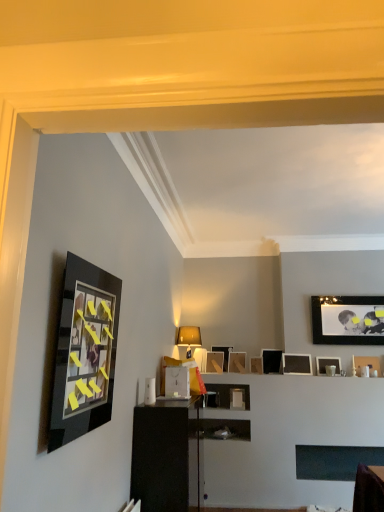
What do you see at coordinates (237, 362) in the screenshot? Image resolution: width=384 pixels, height=512 pixels. I see `matte black picture frame at center, marked as the eighth picture frame in a front-to-back arrangement` at bounding box center [237, 362].

What do you see at coordinates (84, 352) in the screenshot? The image size is (384, 512). I see `matte black picture frame at left, the 10th picture frame from the back` at bounding box center [84, 352].

This screenshot has width=384, height=512. Identify the location of wooden picture frame at center, which appears as the 6th picture frame when viewed from the right. (256, 365).

At what (x,y) coordinates should I click in order to perform the action: click on matte black picture frame at upper right, which is the eighth picture frame from left to right. Please return your answer as a coordinate pair (x, y). Looking at the image, I should click on (328, 364).

Where is `matte white table lamp at center`? matte white table lamp at center is located at coordinates (188, 340).

Would you say wooden picture frame at center, which is the third picture frame from front to back, is part of matte black picture frame at left, the 10th picture frame in the right-to-left sequence,'s contents?

That's incorrect, wooden picture frame at center, which is the third picture frame from front to back, is not inside matte black picture frame at left, the 10th picture frame in the right-to-left sequence.

Identify the location of picture frame that is the 2nd object located behind the matte black picture frame at left, the 10th picture frame in the right-to-left sequence. (256, 365).

Is matte black picture frame at left, the 10th picture frame in the right-to-left sequence, facing away from wooden picture frame at center, which appears as the 6th picture frame when viewed from the right?

No, matte black picture frame at left, the 10th picture frame in the right-to-left sequence,'s orientation is not away from wooden picture frame at center, which appears as the 6th picture frame when viewed from the right.

Based on the photo, from a real-world perspective, who is located higher, matte black picture frame at center, the 4th picture frame positioned from the back, or wooden picture frame at center, the 1th picture frame when ordered from back to front?

In real-world perspective, wooden picture frame at center, the 1th picture frame when ordered from back to front, is above.

Based on the photo, which is more to the left, matte black picture frame at center, the 7th picture frame positioned from the front, or wooden picture frame at center, the 1th picture frame when ordered from back to front?

matte black picture frame at center, the 7th picture frame positioned from the front.

Image resolution: width=384 pixels, height=512 pixels. Find the location of `picture frame that is the 1st object to the left of the wooden picture frame at center, the 1th picture frame when ordered from back to front, starting at the anchor`. picture frame that is the 1st object to the left of the wooden picture frame at center, the 1th picture frame when ordered from back to front, starting at the anchor is located at coordinates (214, 362).

In terms of size, does matte black picture frame at center, positioned as the second picture frame in left-to-right order, appear bigger or smaller than wooden picture frame at center, the 1th picture frame when ordered from back to front?

matte black picture frame at center, positioned as the second picture frame in left-to-right order, is smaller than wooden picture frame at center, the 1th picture frame when ordered from back to front.

Is matte black picture frame at upper right, the second picture frame viewed from the front, positioned before matte black picture frame at upper right, which is the eighth picture frame from left to right?

Yes, matte black picture frame at upper right, the second picture frame viewed from the front, is closer to the camera.

Looking at this image, considering the sizes of objects matte black picture frame at upper right, the first picture frame from the right, and matte black picture frame at upper right, which is the 6th picture frame from back to front, in the image provided, who is bigger, matte black picture frame at upper right, the first picture frame from the right, or matte black picture frame at upper right, which is the 6th picture frame from back to front,?

Bigger between the two is matte black picture frame at upper right, which is the 6th picture frame from back to front.

In terms of height, does matte black picture frame at upper right, acting as the ninth picture frame starting from the back, look taller or shorter compared to matte black picture frame at upper right, the 3th picture frame positioned from the right?

Clearly, matte black picture frame at upper right, acting as the ninth picture frame starting from the back, is shorter compared to matte black picture frame at upper right, the 3th picture frame positioned from the right.

Starting from the matte black picture frame at upper right, which ranks as the 10th picture frame in left-to-right order, which picture frame is the 8th one to the left? Please provide its 2D coordinates.

[(214, 362)]

Which is closer, (364,361) or (220,364)?

Point (364,361) appears to be closer to the viewer than point (220,364).

From a real-world perspective, is matte black picture frame at upper right, acting as the ninth picture frame starting from the back, positioned over matte black picture frame at center, which is the 9th picture frame from right to left, based on gravity?

No, from a real-world perspective, matte black picture frame at upper right, acting as the ninth picture frame starting from the back, is not above matte black picture frame at center, which is the 9th picture frame from right to left.

Is matte black picture frame at center, which is the 2th picture frame in back-to-front order, facing towards matte black picture frame at center, the 3th picture frame from the back?

No, matte black picture frame at center, which is the 2th picture frame in back-to-front order, does not turn towards matte black picture frame at center, the 3th picture frame from the back.

From the image's perspective, between matte black picture frame at center, the fifth picture frame in the right-to-left sequence, and matte black picture frame at center, the 3th picture frame from the back, which one is located above?

matte black picture frame at center, the 3th picture frame from the back.

Is matte black picture frame at center, the 3th picture frame from the back, shorter than matte black picture frame at upper right, which is counted as the 2th picture frame, starting from the right?

Yes.

Is matte black picture frame at center, the 7th picture frame when ordered from right to left, smaller than matte black picture frame at upper right, the 4th picture frame viewed from the front?

Yes, matte black picture frame at center, the 7th picture frame when ordered from right to left, is smaller than matte black picture frame at upper right, the 4th picture frame viewed from the front.

From a real-world perspective, is matte black picture frame at center, marked as the eighth picture frame in a front-to-back arrangement, positioned above or below matte black picture frame at upper right, which is counted as the 2th picture frame, starting from the right?

matte black picture frame at center, marked as the eighth picture frame in a front-to-back arrangement, is situated lower than matte black picture frame at upper right, which is counted as the 2th picture frame, starting from the right, in the real world.

Could matte black picture frame at center, which is the 2th picture frame in back-to-front order, be considered to be inside matte black picture frame at center, which is the 9th picture frame from right to left?

No, matte black picture frame at center, which is the 9th picture frame from right to left, does not contain matte black picture frame at center, which is the 2th picture frame in back-to-front order.

Between matte black picture frame at center, which is the 9th picture frame from right to left, and matte black picture frame at center, the fifth picture frame in the right-to-left sequence, which one has less height?

With less height is matte black picture frame at center, which is the 9th picture frame from right to left.

From the image's perspective, does matte black picture frame at center, the 7th picture frame positioned from the front, appear lower than matte black picture frame at center, which appears as the 9th picture frame when viewed from the front?

No, from the image's perspective, matte black picture frame at center, the 7th picture frame positioned from the front, is not beneath matte black picture frame at center, which appears as the 9th picture frame when viewed from the front.

Would you say matte black picture frame at center, which is the 9th picture frame from right to left, is to the left or to the right of matte black picture frame at center, the fifth picture frame in the right-to-left sequence, in the picture?

In the image, matte black picture frame at center, which is the 9th picture frame from right to left, appears on the left side of matte black picture frame at center, the fifth picture frame in the right-to-left sequence.

From the image's perspective, starting from the matte black picture frame at left, the 1th picture frame positioned from the front, which picture frame is the 9th one below? Please provide its 2D coordinates.

[(256, 365)]

Starting from the wooden picture frame at center, which ranks as the tenth picture frame in front-to-back order, which picture frame is the 3rd one in front? Please provide its 2D coordinates.

[(214, 362)]

Considering their positions, is matte black picture frame at center, the fourth picture frame viewed from the left, positioned closer to black glossy dresser at center than matte black picture frame at upper right, which ranks as the 5th picture frame in front-to-back order?

Based on the image, matte black picture frame at center, the fourth picture frame viewed from the left, appears to be nearer to black glossy dresser at center.

Looking at this image, estimate the real-world distances between objects in this image. Which object is closer to matte black picture frame at center, the 7th picture frame when ordered from right to left, matte black picture frame at upper right, which is the 9th picture frame from left to right, or matte black picture frame at center, positioned as the second picture frame in left-to-right order?

matte black picture frame at center, positioned as the second picture frame in left-to-right order, lies closer to matte black picture frame at center, the 7th picture frame when ordered from right to left, than the other object.

Considering their positions, is black glossy dresser at center positioned closer to matte black picture frame at center, which is the 2th picture frame in back-to-front order, than matte black picture frame at upper right, which ranks as the 10th picture frame in left-to-right order?

Among the two, matte black picture frame at upper right, which ranks as the 10th picture frame in left-to-right order, is located nearer to matte black picture frame at center, which is the 2th picture frame in back-to-front order.

Considering their positions, is matte black picture frame at center, which is the 2th picture frame in back-to-front order, positioned further to matte black picture frame at upper right, which ranks as the 10th picture frame in left-to-right order, than matte black picture frame at center, the fourth picture frame viewed from the left?

Based on the image, matte black picture frame at center, the fourth picture frame viewed from the left, appears to be further to matte black picture frame at upper right, which ranks as the 10th picture frame in left-to-right order.

Looking at this image, considering their positions, is matte black picture frame at center, which appears as the 9th picture frame when viewed from the front, positioned closer to wooden picture frame at center, which is the third picture frame from front to back, than black glossy dresser at center?

Based on the image, matte black picture frame at center, which appears as the 9th picture frame when viewed from the front, appears to be nearer to wooden picture frame at center, which is the third picture frame from front to back.

From the image, which object appears to be farther from matte black picture frame at left, the 10th picture frame in the right-to-left sequence, matte black picture frame at center, which is the 2th picture frame in back-to-front order, or matte white table lamp at center?

Among the two, matte black picture frame at center, which is the 2th picture frame in back-to-front order, is located further to matte black picture frame at left, the 10th picture frame in the right-to-left sequence.

Estimate the real-world distances between objects in this image. Which object is further from wooden picture frame at center, which is the eighth picture frame in right-to-left order, matte black picture frame at upper right, the sixth picture frame positioned from the front, or matte black picture frame at center, the sixth picture frame when ordered from left to right?

matte black picture frame at upper right, the sixth picture frame positioned from the front, is positioned further to the anchor wooden picture frame at center, which is the eighth picture frame in right-to-left order.

Based on their spatial positions, is matte white table lamp at center or matte black picture frame at left, the 1th picture frame positioned from the front, closer to matte black picture frame at upper right, which is the eighth picture frame from left to right?

Based on the image, matte white table lamp at center appears to be nearer to matte black picture frame at upper right, which is the eighth picture frame from left to right.

Find the location of `table lamp located between matte black picture frame at left, the 10th picture frame in the right-to-left sequence, and matte black picture frame at upper right, which is counted as the 2th picture frame, starting from the right, in the depth direction`. table lamp located between matte black picture frame at left, the 10th picture frame in the right-to-left sequence, and matte black picture frame at upper right, which is counted as the 2th picture frame, starting from the right, in the depth direction is located at coordinates coord(188,340).

This screenshot has height=512, width=384. I want to click on table lamp between black glossy dresser at center and matte black picture frame at center, the 4th picture frame positioned from the back, along the z-axis, so click(188, 340).

Where is `dresser located between matte black picture frame at left, the 1th picture frame positioned from the front, and matte black picture frame at center, positioned as the second picture frame in left-to-right order, in the depth direction`? This screenshot has width=384, height=512. dresser located between matte black picture frame at left, the 1th picture frame positioned from the front, and matte black picture frame at center, positioned as the second picture frame in left-to-right order, in the depth direction is located at coordinates (163, 455).

This screenshot has width=384, height=512. Identify the location of picture frame located between black glossy dresser at center and wooden picture frame at center, which is counted as the 8th picture frame, starting from the back, in the depth direction. (366, 362).